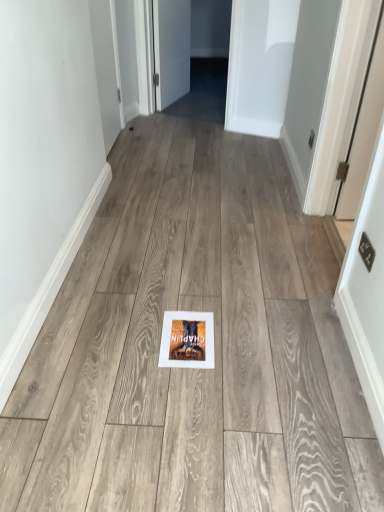
The width and height of the screenshot is (384, 512). Find the location of `free spot behind matte gold postcard at center`. free spot behind matte gold postcard at center is located at coordinates (187, 292).